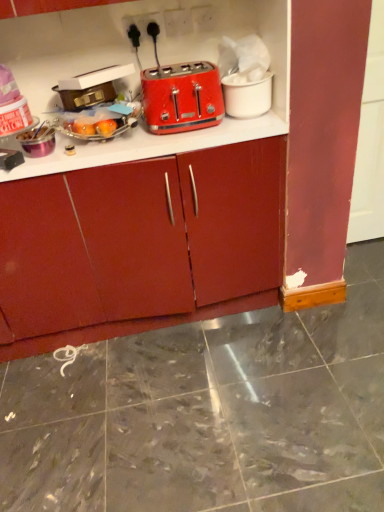
Identify the location of free space in front of matte red cabinet at center. The height and width of the screenshot is (512, 384). (152, 418).